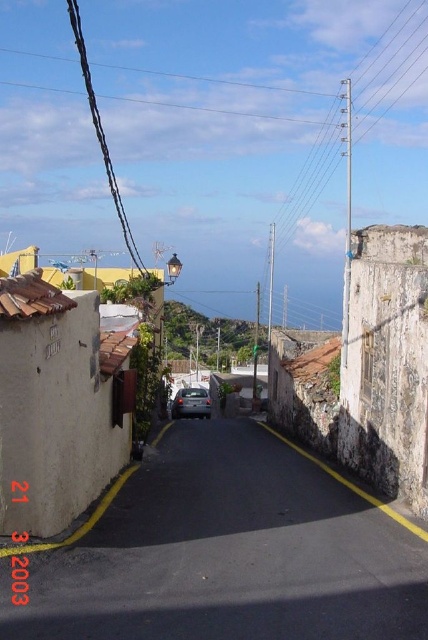
You are standing on the sidewalk in this coastal town street scene. You need to cross the street to reach the old buildings on the other side. The black asphalt road at center is the only road in view. Given that you can walk at a normal pace, will you be able to cross the road safely before any vehicles arrive?

The black asphalt road at center is 4.70 meters away from viewer. Since the road is narrow and there are no vehicles visible in the image, you can cross safely before any vehicles arrive.

You are a delivery person trying to park your 2.5m wide van between the stucco wall at right and the satin black car at center. Can your van fit in the space between them?

The stucco wall at right is in front of the satin black car at center, so the distance between them is not specified. However, since the street is narrow, it might not accommodate a 2.5m wide van. Without exact measurements, it is uncertain if the van can fit.

You are a delivery person trying to park your 2.5 meters tall delivery van. You see the stucco wall at right and the satin black car at center. Can your van fit between them without hitting anything?

The stucco wall at right is above the satin black car at center, so the vertical space between them is sufficient for the van to pass through as the wall is positioned higher up and not blocking the path. However, ensure there is enough horizontal space between the car and the wall for the van to maneuver safely.